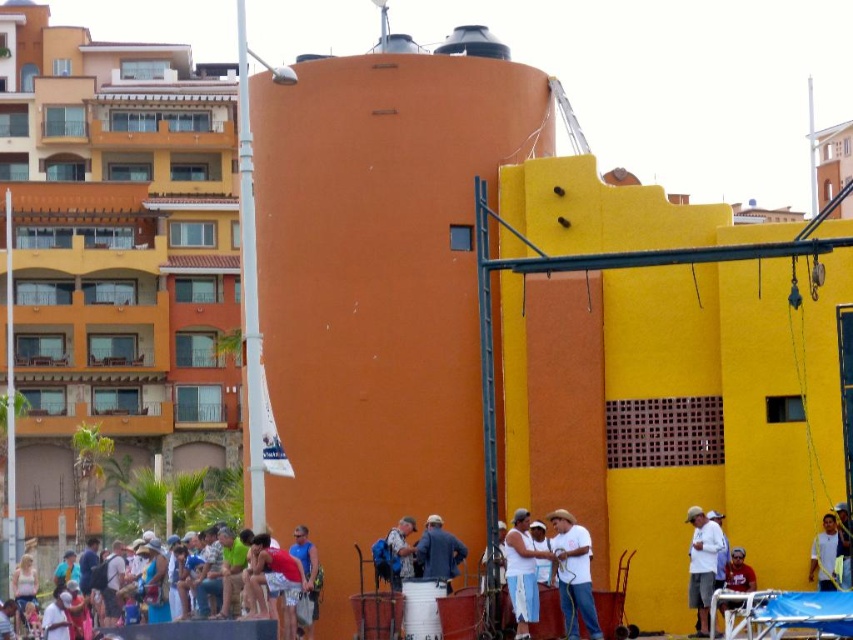
Question: Which object is closer to the camera taking this photo?

Choices:
 (A) white matte tank top at center
 (B) white matte shirt at center
 (C) white matte shirt at lower right
 (D) matte red shirt at lower right

Answer: (B)

Question: Does matte blue shirt at center appear over dark blue fabric jacket at center?

Choices:
 (A) no
 (B) yes

Answer: (A)

Question: Which point is closer to the camera?

Choices:
 (A) (751, 580)
 (B) (698, 586)
 (C) (563, 518)
 (D) (525, 605)

Answer: (D)

Question: Which object appears farthest from the camera in this image?

Choices:
 (A) blue fabric shirt at lower center
 (B) white matte shirt at lower right
 (C) white matte shirt at center
 (D) matte red shirt at lower right

Answer: (A)

Question: Does matte blue shirt at center have a lesser width compared to denim jacket at lower center?

Choices:
 (A) no
 (B) yes

Answer: (B)

Question: Does white matte tank top at center have a smaller size compared to blue fabric shirt at lower center?

Choices:
 (A) no
 (B) yes

Answer: (A)